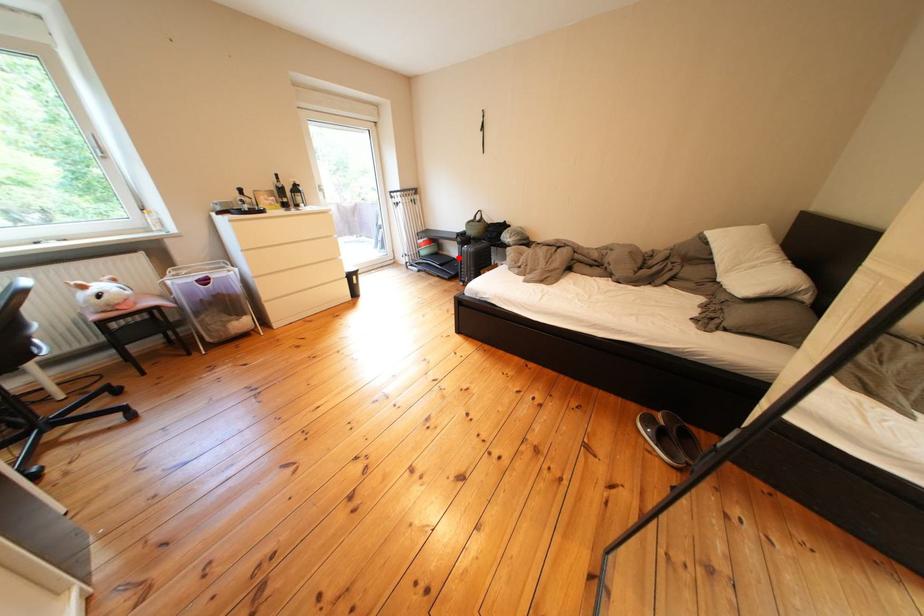
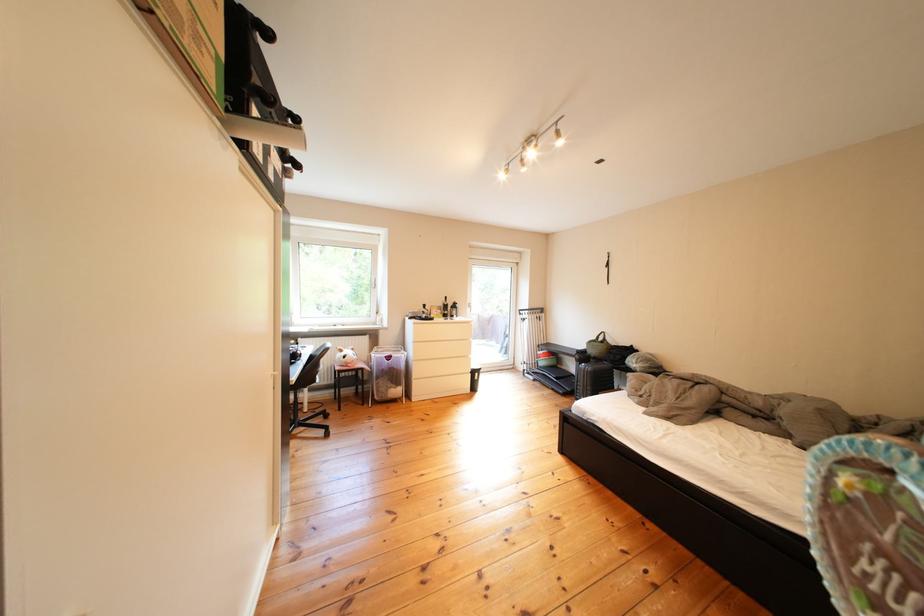
Question: I am providing you with two images of the same scene from different viewpoints. A red point is shown in image1. For the corresponding object point in image2, is it positioned nearer or farther from the camera?

Choices:
 (A) Nearer
 (B) Farther

Answer: (B)